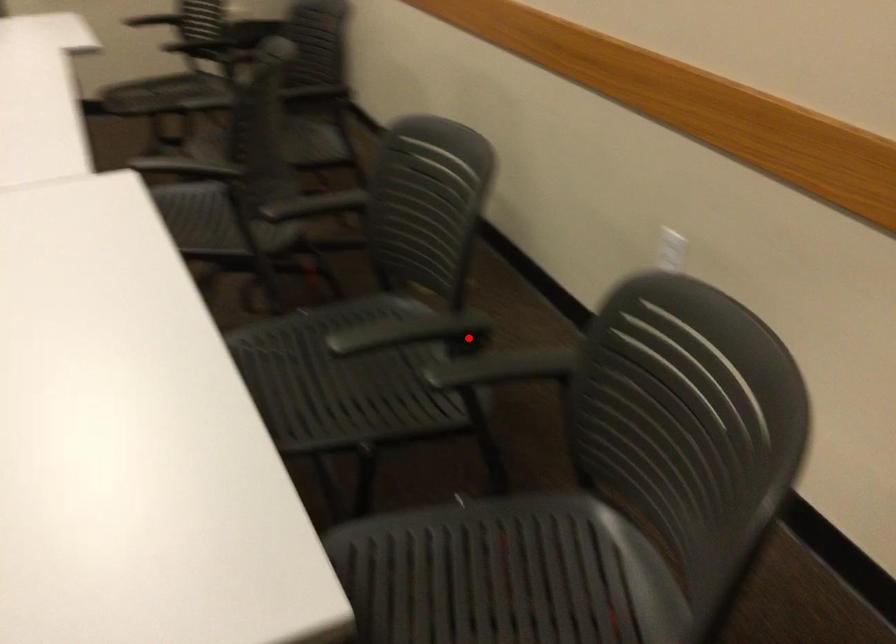
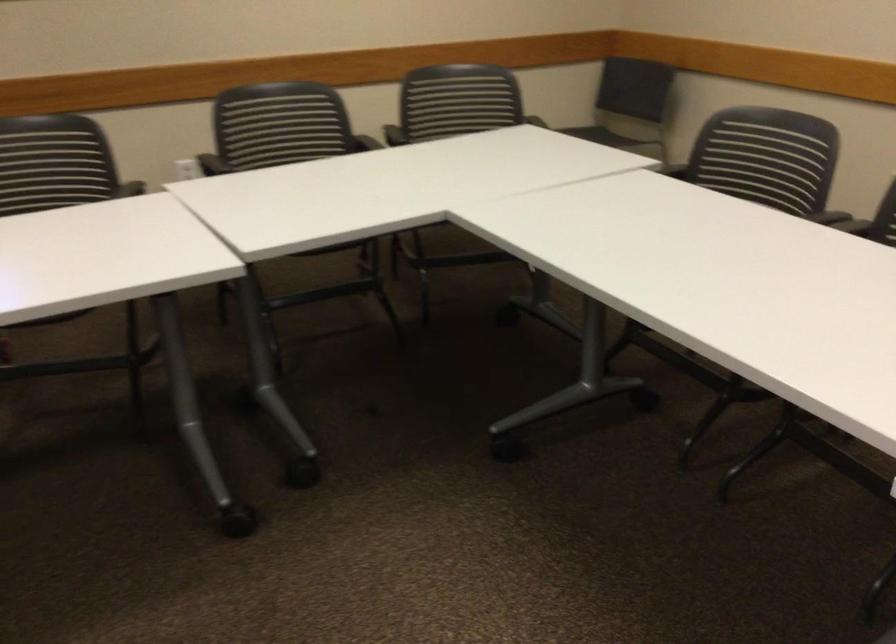
Question: I am providing you with two images of the same scene from different viewpoints. A red point is marked on the first image. At the location where the point appears in image 1, is it still visible in image 2?

Choices:
 (A) Yes
 (B) No

Answer: (A)